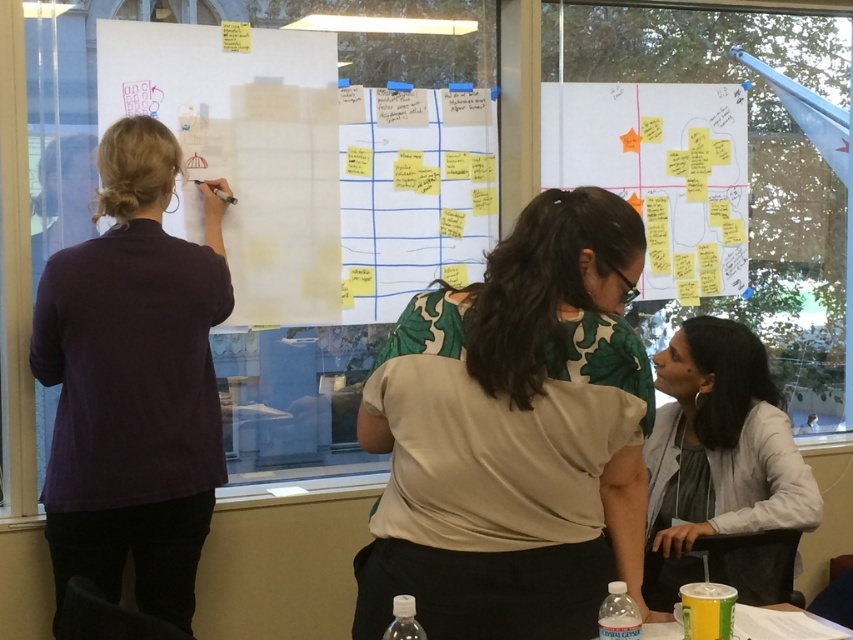
Question: Which point is farther from the camera taking this photo?

Choices:
 (A) (838, 637)
 (B) (770, 461)
 (C) (111, 502)

Answer: (B)

Question: From the image, what is the correct spatial relationship of white matte paperboard at upper center in relation to gray fabric shirt at lower right?

Choices:
 (A) right
 (B) left

Answer: (A)

Question: Does green floral blouse at center appear on the left side of purple cotton shirt at left?

Choices:
 (A) yes
 (B) no

Answer: (B)

Question: Which point is farther to the camera?

Choices:
 (A) (379, 556)
 (B) (747, 612)

Answer: (B)

Question: Which of the following is the farthest from the observer?

Choices:
 (A) white matte whiteboard at left
 (B) purple cotton shirt at left
 (C) gray fabric shirt at lower right
 (D) yellow sticky notes at center

Answer: (D)

Question: Is green floral blouse at center closer to the viewer compared to white matte whiteboard at left?

Choices:
 (A) yes
 (B) no

Answer: (A)